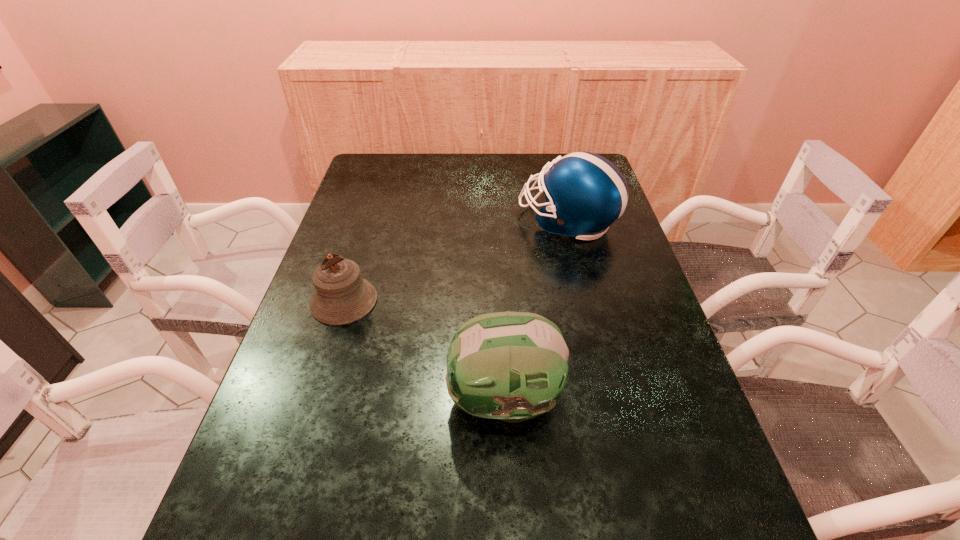
At what (x,y) coordinates should I click in order to perform the action: click on the farther football helmet. Please return your answer as a coordinate pair (x, y). The height and width of the screenshot is (540, 960). Looking at the image, I should click on (585, 193).

The image size is (960, 540). Identify the location of the nearer football helmet. (512, 366).

The height and width of the screenshot is (540, 960). Identify the location of the shortest object. (342, 296).

The image size is (960, 540). Identify the location of the second farthest object. (342, 296).

Identify the location of vacant space located at the front of the farther football helmet with the faceguard. (499, 221).

Locate an element on the screen. The width and height of the screenshot is (960, 540). free space located at the front of the farther football helmet with the faceguard is located at coordinates (469, 221).

Where is `free spot located at the front of the farther football helmet with the faceguard`? This screenshot has height=540, width=960. free spot located at the front of the farther football helmet with the faceguard is located at coordinates (410, 221).

The image size is (960, 540). I want to click on free location located on the visor of the nearer football helmet, so click(388, 400).

Find the location of a particular element. The width and height of the screenshot is (960, 540). vacant region located on the visor of the nearer football helmet is located at coordinates pyautogui.click(x=397, y=400).

I want to click on free space located 0.100m on the visor of the nearer football helmet, so click(x=397, y=400).